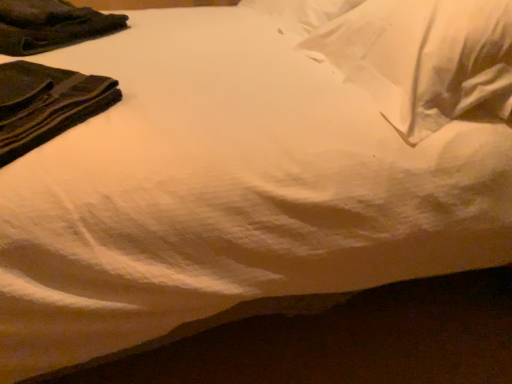
Question: Can you confirm if dark green fabric at upper left, acting as the 2th clothing starting from the front, is positioned to the left of dark green fabric at upper left, the 2th clothing in the back-to-front sequence?

Choices:
 (A) no
 (B) yes

Answer: (B)

Question: Is the position of dark green fabric at upper left, acting as the 2th clothing starting from the front, more distant than that of dark green fabric at upper left, the 1th clothing in the bottom-to-top sequence?

Choices:
 (A) no
 (B) yes

Answer: (B)

Question: From the image's perspective, is dark green fabric at upper left, acting as the 2th clothing starting from the front, beneath dark green fabric at upper left, positioned as the 2th clothing in top-to-bottom order?

Choices:
 (A) no
 (B) yes

Answer: (A)

Question: Is dark green fabric at upper left, the first clothing from the back, placed right next to dark green fabric at upper left, positioned as the first clothing in front-to-back order?

Choices:
 (A) yes
 (B) no

Answer: (B)

Question: Is dark green fabric at upper left, the 1th clothing in the top-to-bottom sequence, facing towards dark green fabric at upper left, the 1th clothing in the bottom-to-top sequence?

Choices:
 (A) no
 (B) yes

Answer: (A)

Question: From the image's perspective, is dark green fabric at upper left, the 1th clothing in the top-to-bottom sequence, located above or below dark green fabric at upper left, positioned as the first clothing in front-to-back order?

Choices:
 (A) below
 (B) above

Answer: (B)

Question: From their relative heights in the image, would you say dark green fabric at upper left, the first clothing from the back, is taller or shorter than dark green fabric at upper left, positioned as the first clothing in front-to-back order?

Choices:
 (A) short
 (B) tall

Answer: (A)

Question: Is dark green fabric at upper left, arranged as the second clothing when ordered from the bottom, wider or thinner than dark green fabric at upper left, positioned as the first clothing in front-to-back order?

Choices:
 (A) wide
 (B) thin

Answer: (A)

Question: Considering the relative positions of dark green fabric at upper left, the first clothing from the back, and dark green fabric at upper left, positioned as the first clothing in front-to-back order, in the image provided, is dark green fabric at upper left, the first clothing from the back, to the left or to the right of dark green fabric at upper left, positioned as the first clothing in front-to-back order,?

Choices:
 (A) right
 (B) left

Answer: (B)

Question: Considering the positions of dark green fabric at upper left, the 1th clothing in the top-to-bottom sequence, and white soft pillow at upper right in the image, is dark green fabric at upper left, the 1th clothing in the top-to-bottom sequence, bigger or smaller than white soft pillow at upper right?

Choices:
 (A) big
 (B) small

Answer: (B)

Question: Does point (6, 3) appear closer or farther from the camera than point (357, 41)?

Choices:
 (A) farther
 (B) closer

Answer: (A)

Question: Looking at their shapes, would you say dark green fabric at upper left, acting as the 2th clothing starting from the front, is wider or thinner than white soft pillow at upper right?

Choices:
 (A) wide
 (B) thin

Answer: (B)

Question: From the image's perspective, is dark green fabric at upper left, arranged as the second clothing when ordered from the bottom, above or below white soft pillow at upper right?

Choices:
 (A) below
 (B) above

Answer: (B)

Question: Based on their sizes in the image, would you say white soft pillow at upper right is bigger or smaller than dark green fabric at upper left, acting as the 2th clothing starting from the front?

Choices:
 (A) big
 (B) small

Answer: (A)

Question: In the image, is white soft pillow at upper right on the left side or the right side of dark green fabric at upper left, arranged as the second clothing when ordered from the bottom?

Choices:
 (A) right
 (B) left

Answer: (A)